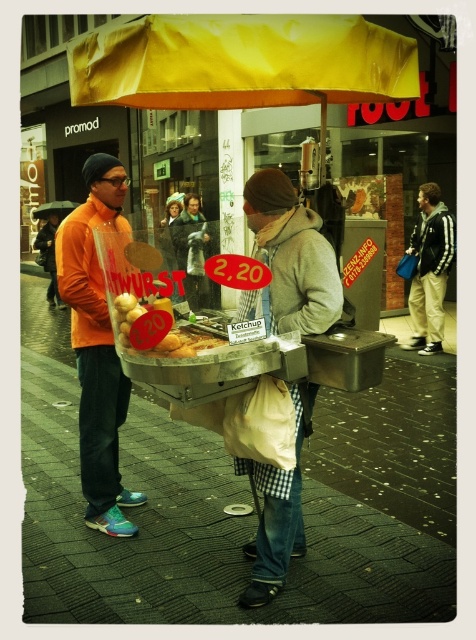
From the picture: Does yellow fabric canopy at upper center lie behind khaki pants at center?

No, yellow fabric canopy at upper center is in front of khaki pants at center.

Is yellow fabric canopy at upper center smaller than khaki pants at center?

No, yellow fabric canopy at upper center is not smaller than khaki pants at center.

Does point (369, 58) lie behind point (435, 310)?

No, it is not.

The height and width of the screenshot is (640, 476). I want to click on yellow fabric canopy at upper center, so click(x=241, y=61).

Does golden brown bread at center come in front of green wool coat at center?

Yes, it is.

Consider the image. How distant is golden brown bread at center from green wool coat at center?

21.37 inches

Identify the location of golden brown bread at center. (158, 328).

Is orange matte jacket at left thinner than green wool coat at center?

Indeed, orange matte jacket at left has a lesser width compared to green wool coat at center.

I want to click on orange matte jacket at left, so click(x=97, y=346).

I want to click on orange matte jacket at left, so click(97, 346).